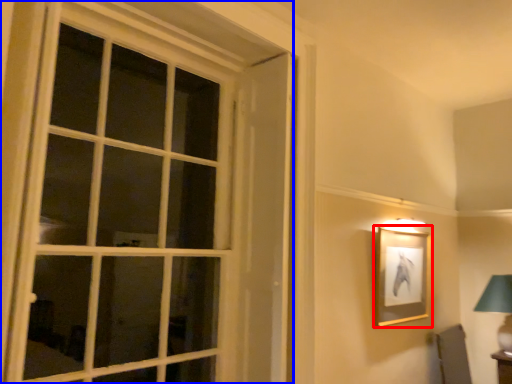
Question: Which object appears closest to the camera in this image, picture frame (highlighted by a red box) or window (highlighted by a blue box)?

Choices:
 (A) picture frame
 (B) window

Answer: (B)